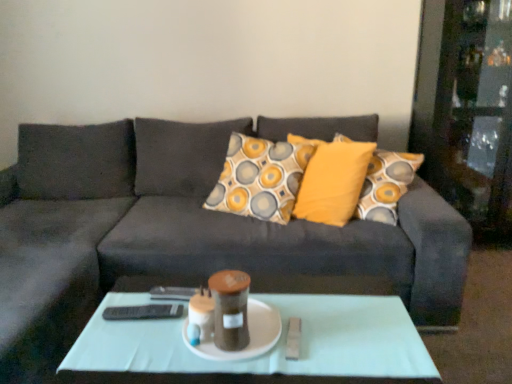
Question: Would you say white ceramic plate at center is outside dark gray fabric couch at center?

Choices:
 (A) no
 (B) yes

Answer: (A)

Question: Is white ceramic plate at center bigger than dark gray fabric couch at center?

Choices:
 (A) no
 (B) yes

Answer: (A)

Question: Is white ceramic plate at center wider than dark gray fabric couch at center?

Choices:
 (A) yes
 (B) no

Answer: (B)

Question: Is white ceramic plate at center looking in the opposite direction of dark gray fabric couch at center?

Choices:
 (A) no
 (B) yes

Answer: (B)

Question: Is white ceramic plate at center directly adjacent to dark gray fabric couch at center?

Choices:
 (A) yes
 (B) no

Answer: (B)

Question: In the image, is white ceramic plate at center positioned in front of or behind light green glass coffee table at center?

Choices:
 (A) behind
 (B) front

Answer: (A)

Question: Is white ceramic plate at center inside the boundaries of light green glass coffee table at center, or outside?

Choices:
 (A) outside
 (B) inside

Answer: (A)

Question: From the image's perspective, is white ceramic plate at center positioned above or below light green glass coffee table at center?

Choices:
 (A) below
 (B) above

Answer: (B)

Question: From a real-world perspective, is white ceramic plate at center physically located above or below light green glass coffee table at center?

Choices:
 (A) above
 (B) below

Answer: (A)

Question: Is point (105, 210) positioned closer to the camera than point (247, 304)?

Choices:
 (A) farther
 (B) closer

Answer: (A)

Question: Looking at their shapes, would you say dark gray fabric couch at center is wider or thinner than white ceramic plate at center?

Choices:
 (A) thin
 (B) wide

Answer: (B)

Question: Would you say dark gray fabric couch at center is inside or outside white ceramic plate at center?

Choices:
 (A) inside
 (B) outside

Answer: (B)

Question: From the image's perspective, is dark gray fabric couch at center located above or below white ceramic plate at center?

Choices:
 (A) above
 (B) below

Answer: (A)

Question: In terms of size, does light green glass coffee table at center appear bigger or smaller than white ceramic plate at center?

Choices:
 (A) big
 (B) small

Answer: (A)

Question: Considering the positions of light green glass coffee table at center and white ceramic plate at center in the image, is light green glass coffee table at center wider or thinner than white ceramic plate at center?

Choices:
 (A) thin
 (B) wide

Answer: (B)